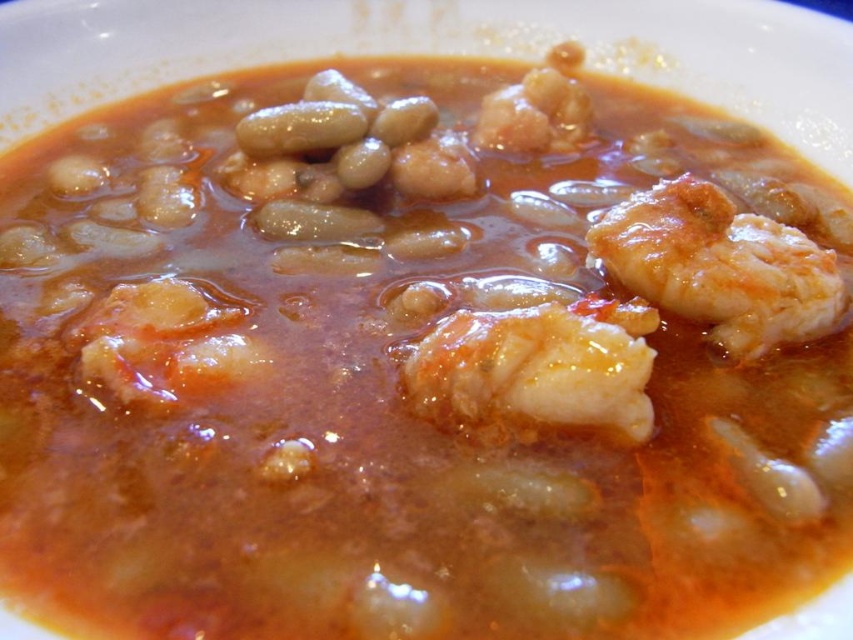
You are a food critic evaluating this dish. You notice two types of shrimp in the dish. Which shrimp is wider, the translucent gelatinous shrimp at center or the white glossy shrimp at right?

The white glossy shrimp at right is wider than the translucent gelatinous shrimp at center.

You are a food critic evaluating the presentation of this dish. The dish contains a translucent gelatinous shrimp at center and a white glossy shrimp at right. Which shrimp takes up more visual space in the dish?

The white glossy shrimp at right occupies more space than the translucent gelatinous shrimp at center, so it takes up more visual space in the dish.

You are looking at the dish and want to pick up the utensil closest to you. Which point, point (618, 304) or point (752, 241), is closer to you?

Point (618, 304) is closer to the viewer than point (752, 241), so you should pick up the utensil at point (618, 304).